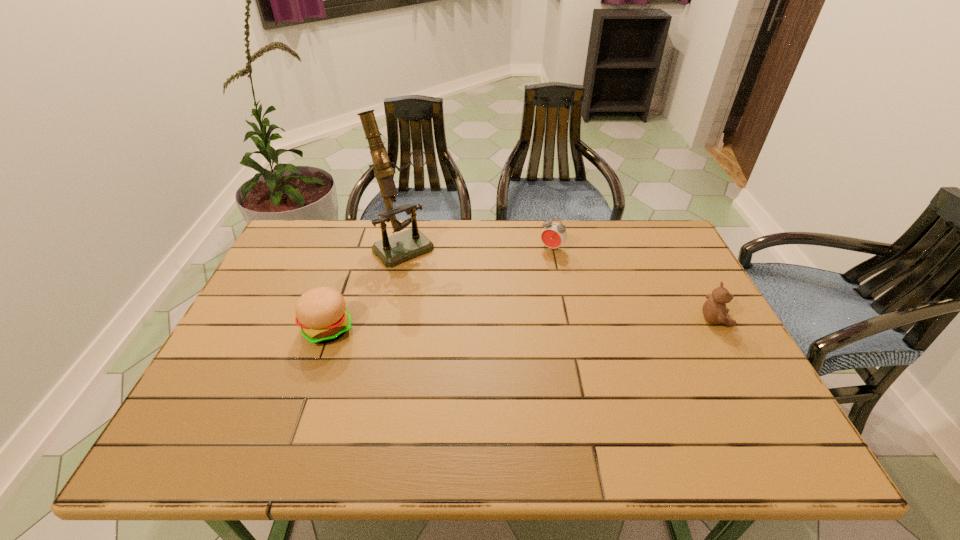
The image size is (960, 540). I want to click on vacant region located at the eyepiece of the microscope, so click(456, 303).

Identify the location of alarm clock present at the far edge. (554, 234).

The image size is (960, 540). I want to click on microscope present at the far edge, so click(x=400, y=247).

This screenshot has height=540, width=960. I want to click on object located in the right edge section of the desktop, so click(x=714, y=310).

Identify the location of vacant space at the far edge of the desktop. The image size is (960, 540). (586, 238).

Where is `free region at the near edge of the desktop`? The width and height of the screenshot is (960, 540). free region at the near edge of the desktop is located at coordinates (405, 404).

Find the location of a particular element. The width and height of the screenshot is (960, 540). vacant position at the left edge of the desktop is located at coordinates (277, 284).

The height and width of the screenshot is (540, 960). I want to click on free space at the right edge of the desktop, so click(x=638, y=269).

Where is `vacant space at the far left corner of the desktop`? vacant space at the far left corner of the desktop is located at coordinates (280, 255).

Where is `vacant space at the far right corner of the desktop`? The image size is (960, 540). vacant space at the far right corner of the desktop is located at coordinates (685, 259).